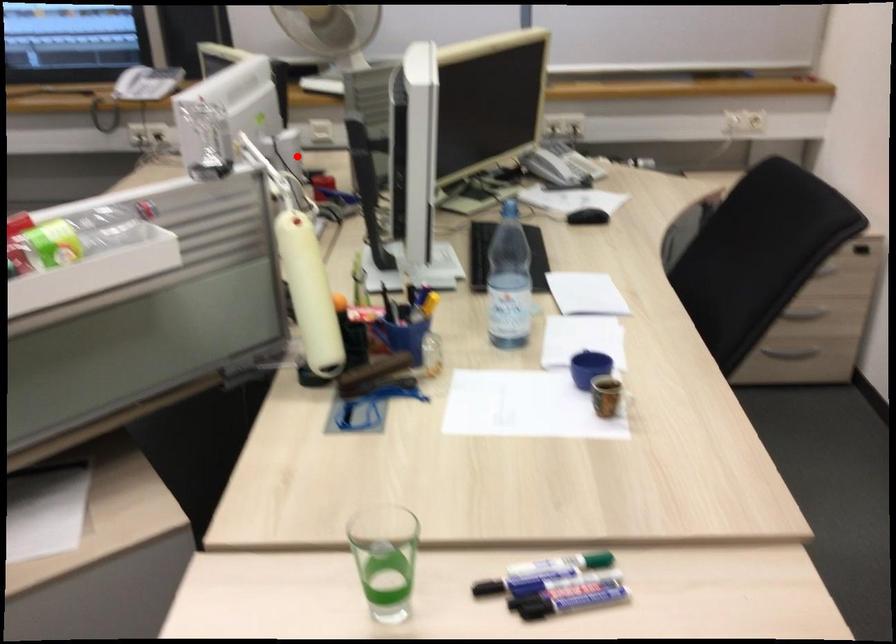
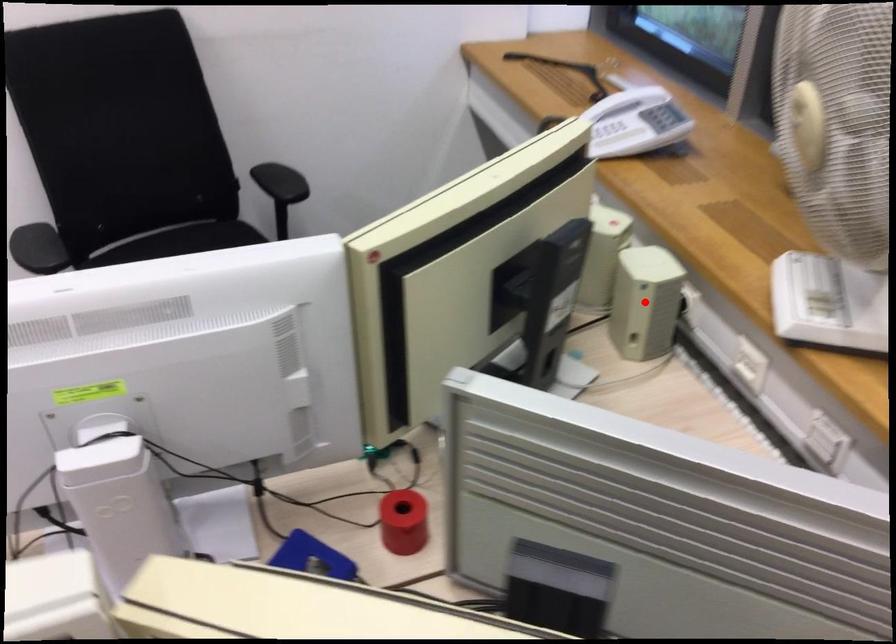
I am providing you with two images of the same scene from different viewpoints. A red point is marked on the first image and another point is marked on the second image. Is the red point in image1 aligned with the point shown in image2?

No